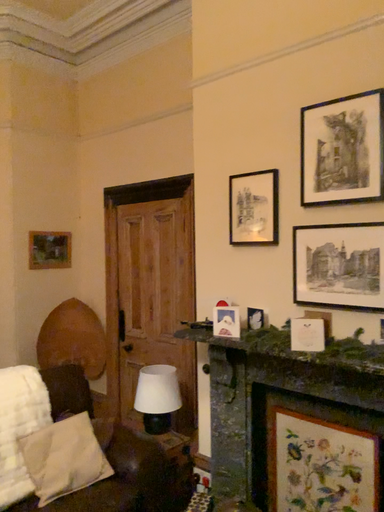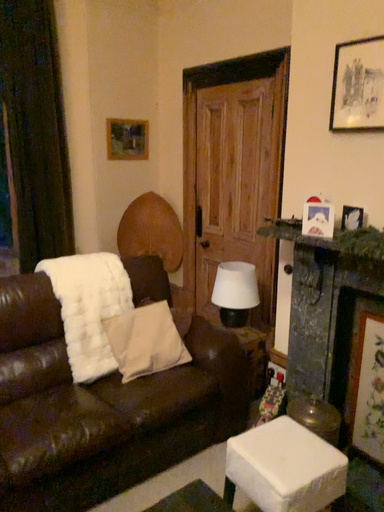
Question: How did the camera likely rotate when shooting the video?

Choices:
 (A) rotated downward
 (B) rotated upward

Answer: (A)